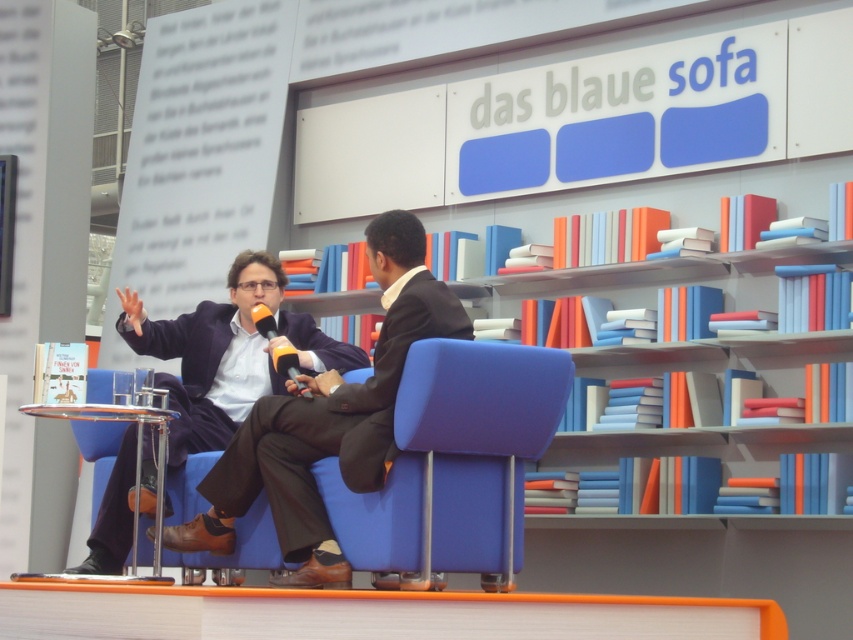
Question: Among these points, which one is farthest from the camera?

Choices:
 (A) (277, 364)
 (B) (311, 401)

Answer: (A)

Question: Does dark blue fabric business suit at center lie behind matte yellow microphone at center?

Choices:
 (A) no
 (B) yes

Answer: (B)

Question: Among these objects, which one is farthest from the camera?

Choices:
 (A) dark blue fabric business suit at center
 (B) dark brown woolen suit at center

Answer: (A)

Question: Is dark brown woolen suit at center to the right of matte yellow microphone at center from the viewer's perspective?

Choices:
 (A) yes
 (B) no

Answer: (A)

Question: Does dark brown woolen suit at center appear under dark blue fabric business suit at center?

Choices:
 (A) no
 (B) yes

Answer: (B)

Question: Which point appears farthest from the camera in this image?

Choices:
 (A) (123, 531)
 (B) (466, 337)

Answer: (A)